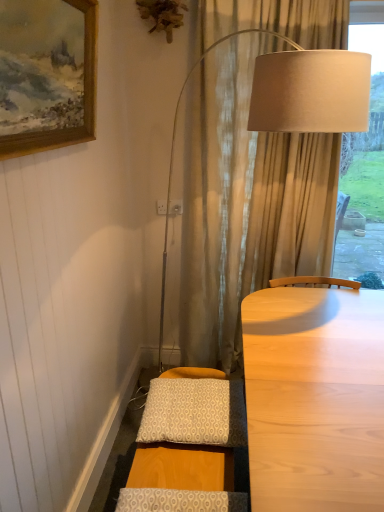
Question: Is patterned fabric pillow at lower center, the second pillow ordered from the bottom, situated inside wooden framed painting at upper left or outside?

Choices:
 (A) inside
 (B) outside

Answer: (B)

Question: Would you say patterned fabric pillow at lower center, which ranks as the 1th pillow in top-to-bottom order, is to the left or to the right of wooden framed painting at upper left in the picture?

Choices:
 (A) right
 (B) left

Answer: (A)

Question: Which of these objects is positioned closest to the wooden framed painting at upper left?

Choices:
 (A) patterned fabric pillow at lower center, the 2th pillow viewed from the top
 (B) patterned fabric pillow at lower center, the second pillow in the front-to-back sequence

Answer: (B)

Question: Estimate the real-world distances between objects in this image. Which object is closer to the patterned fabric pillow at lower center, positioned as the first pillow in bottom-to-top order?

Choices:
 (A) patterned fabric pillow at lower center, the second pillow in the front-to-back sequence
 (B) wooden framed painting at upper left

Answer: (A)